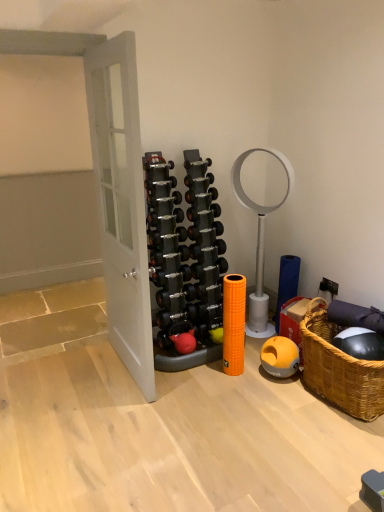
Where is `free point in front of white matte door at left`? The height and width of the screenshot is (512, 384). free point in front of white matte door at left is located at coordinates (123, 415).